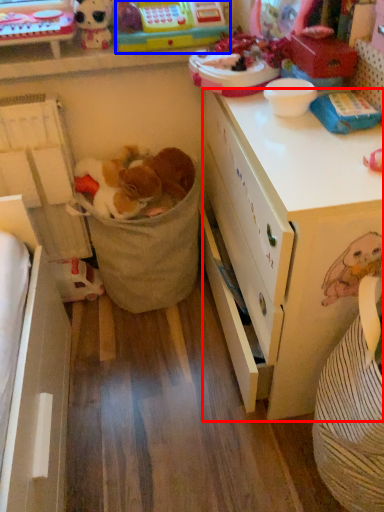
Question: Which object appears farthest to the camera in this image, desk (highlighted by a red box) or toy (highlighted by a blue box)?

Choices:
 (A) desk
 (B) toy

Answer: (B)